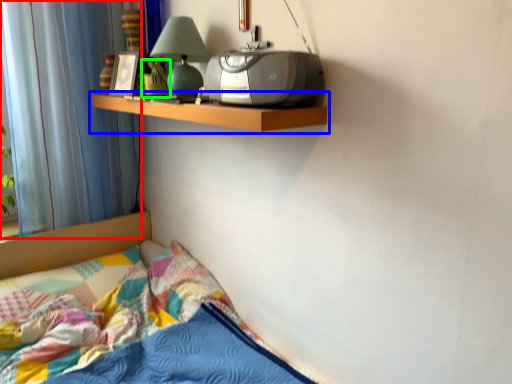
Question: Based on their relative distances, which object is nearer to curtain (highlighted by a red box)? Choose from shelf (highlighted by a blue box) and toy (highlighted by a green box).

Choices:
 (A) shelf
 (B) toy

Answer: (A)